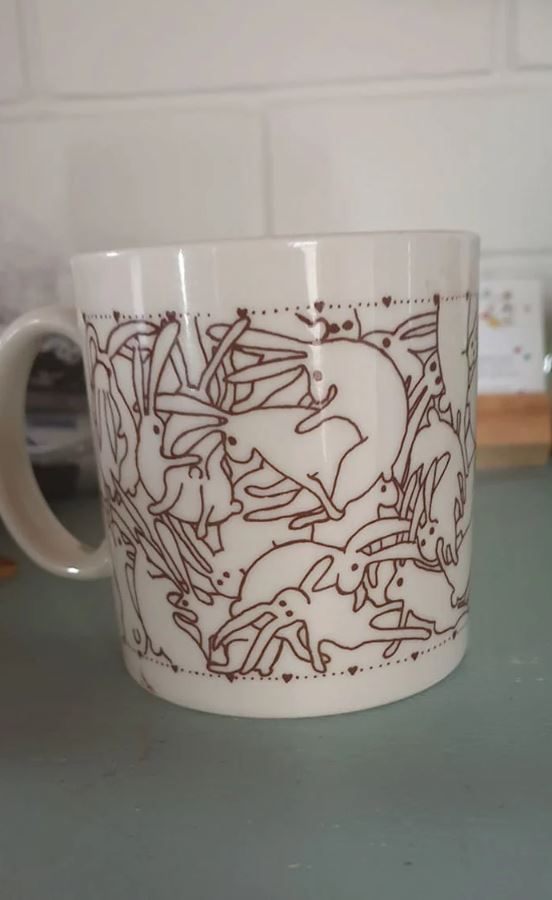
Locate an element on the screen. countertop is located at coordinates (509, 724), (93, 781), (327, 839).